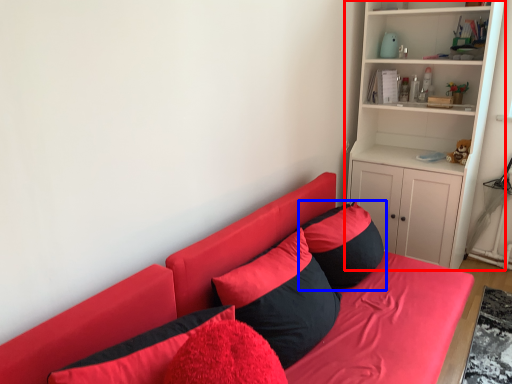
Question: Which of the following is the closest to the observer, shelf (highlighted by a red box) or pillow (highlighted by a blue box)?

Choices:
 (A) shelf
 (B) pillow

Answer: (B)